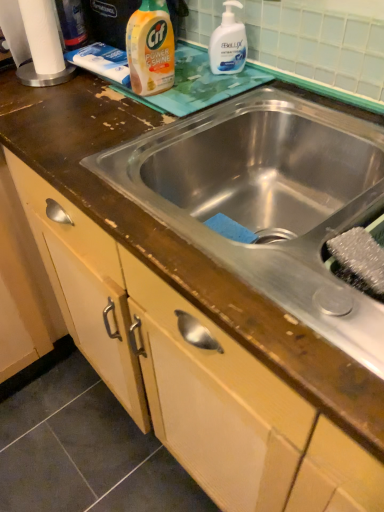
Where is `vacant space to the right of yellow plastic bottle at upper center, the 2th cleaning product positioned from the right`? Image resolution: width=384 pixels, height=512 pixels. vacant space to the right of yellow plastic bottle at upper center, the 2th cleaning product positioned from the right is located at coordinates (209, 85).